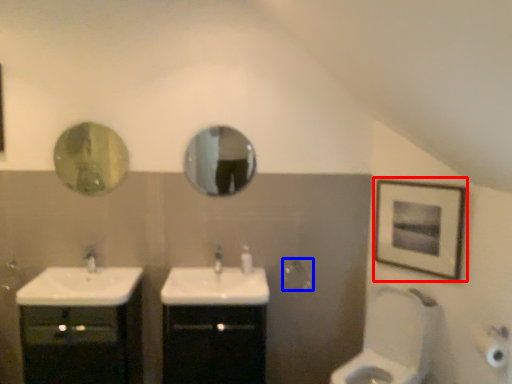
Question: Among these objects, which one is farthest to the camera, picture frame (highlighted by a red box) or towel bar (highlighted by a blue box)?

Choices:
 (A) picture frame
 (B) towel bar

Answer: (B)